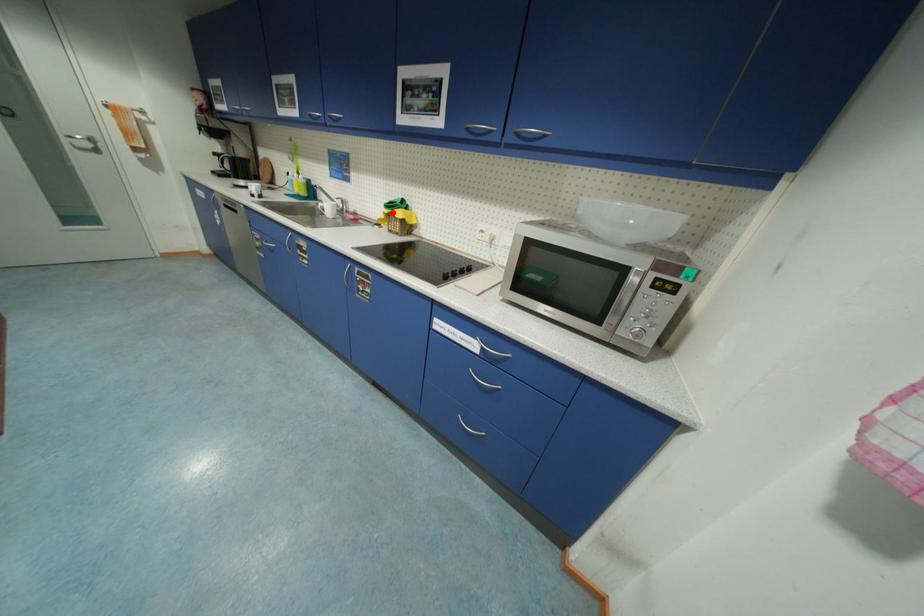
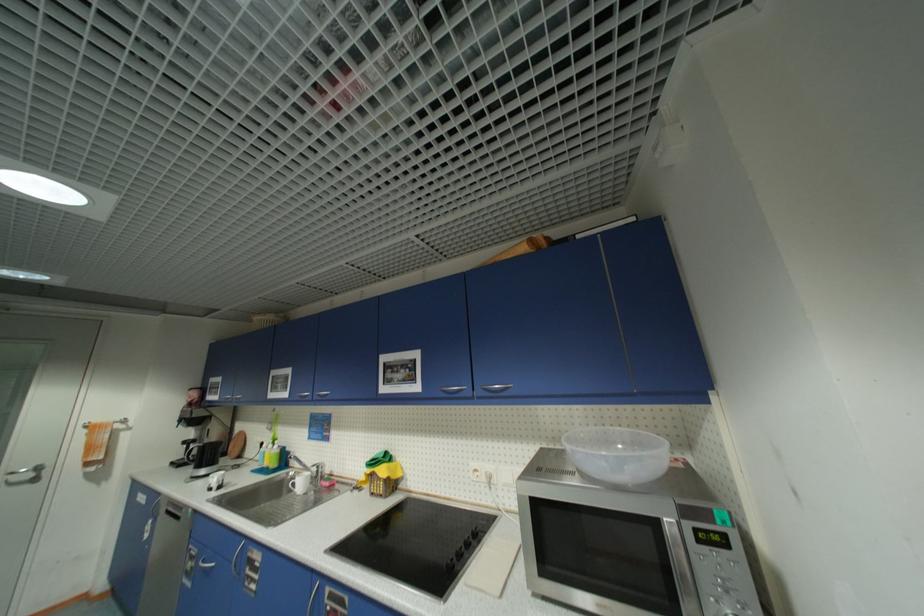
Locate, in the second image, the point that corresponds to the highlighted location in the first image.

(374, 472)